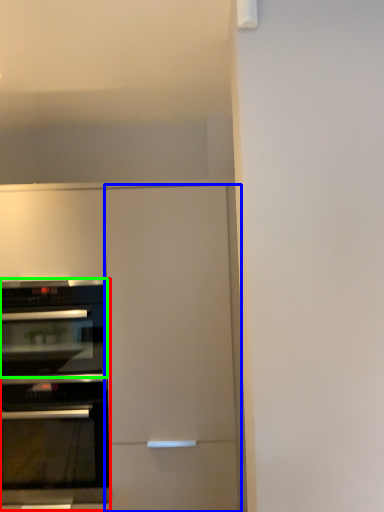
Question: Based on their relative distances, which object is nearer to oven (highlighted by a red box)? Choose from door (highlighted by a blue box) and oven (highlighted by a green box).

Choices:
 (A) door
 (B) oven

Answer: (B)